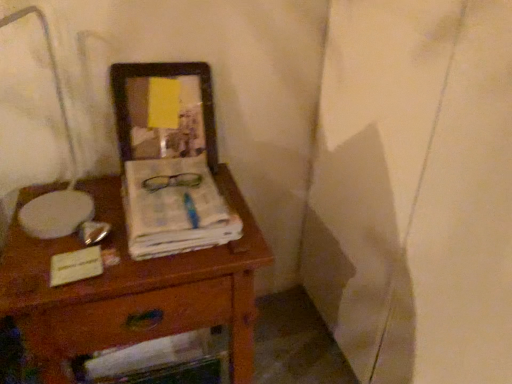
Question: Looking at the image, does wooden picture frame at upper center seem bigger or smaller compared to white paper at center?

Choices:
 (A) small
 (B) big

Answer: (B)

Question: Relative to white paper at center, is wooden picture frame at upper center in front or behind?

Choices:
 (A) front
 (B) behind

Answer: (B)

Question: Which object is positioned farthest from the wooden picture frame at upper center?

Choices:
 (A) wooden desk at center
 (B) wooden drawer at lower center
 (C) white paper at center

Answer: (B)

Question: Which object is the farthest from the wooden desk at center?

Choices:
 (A) white paper at center
 (B) wooden drawer at lower center
 (C) wooden picture frame at upper center

Answer: (C)